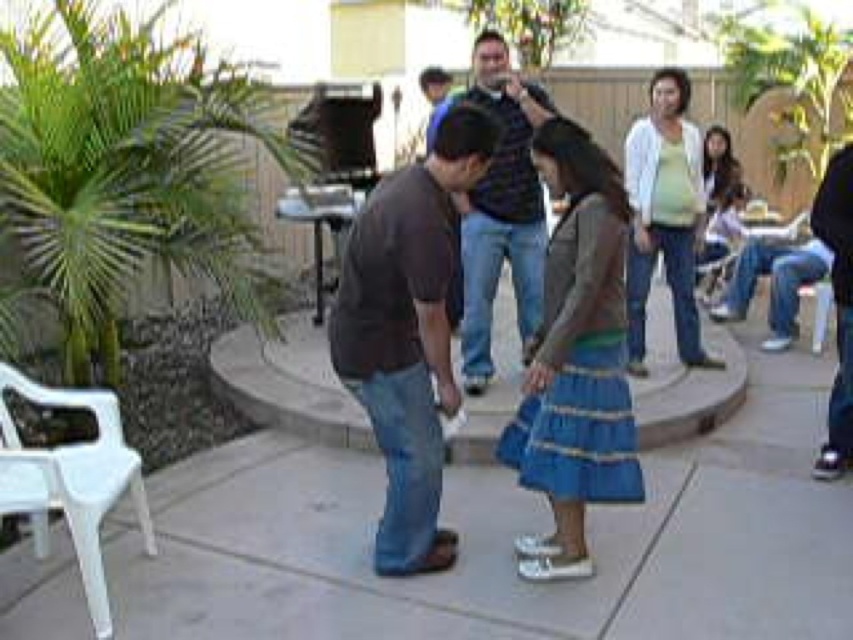
Does point (566, 138) come behind point (630, 140)?

No, (566, 138) is in front of (630, 140).

This screenshot has width=853, height=640. Describe the element at coordinates (575, 358) in the screenshot. I see `blue textured skirt at center` at that location.

Where is `blue textured skirt at center`? blue textured skirt at center is located at coordinates (575, 358).

Does brown cotton shirt at center have a larger size compared to dark blue jeans at center?

Yes, brown cotton shirt at center is bigger than dark blue jeans at center.

Is point (379, 193) farther from camera compared to point (503, 216)?

No, (379, 193) is in front of (503, 216).

Find the location of `brown cotton shirt at center`. brown cotton shirt at center is located at coordinates (407, 332).

Can you confirm if brown cotton shirt at center is positioned to the right of blue textured skirt at center?

No, brown cotton shirt at center is not to the right of blue textured skirt at center.

Can you confirm if brown cotton shirt at center is smaller than blue textured skirt at center?

Actually, brown cotton shirt at center might be larger than blue textured skirt at center.

Does point (343, 260) come behind point (579, 524)?

No.

Find the location of a particular element. This screenshot has width=853, height=640. brown cotton shirt at center is located at coordinates (x=407, y=332).